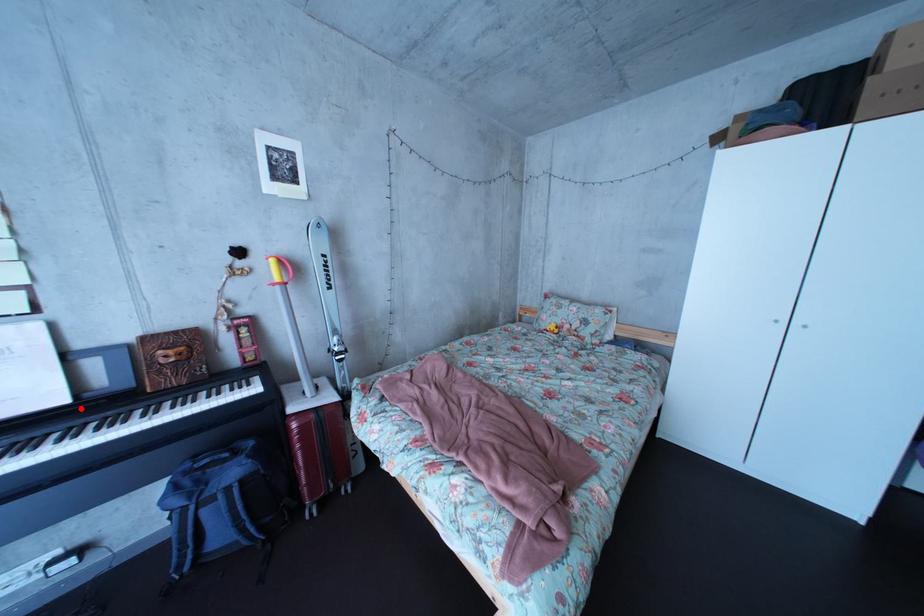
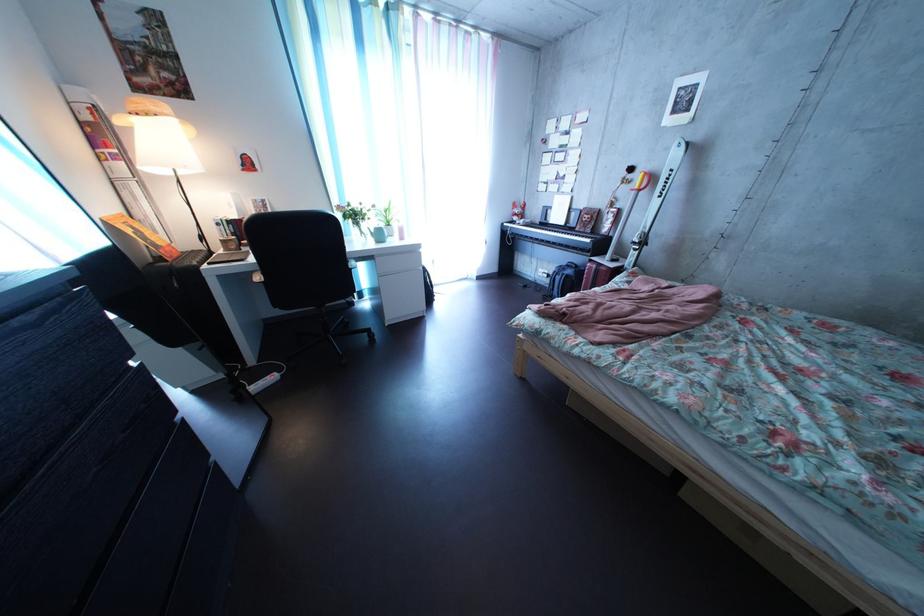
Question: I am providing you with two images of the same scene from different viewpoints. A red point is shown in image1. For the corresponding object point in image2, is it positioned nearer or farther from the camera?

Choices:
 (A) Nearer
 (B) Farther

Answer: (A)